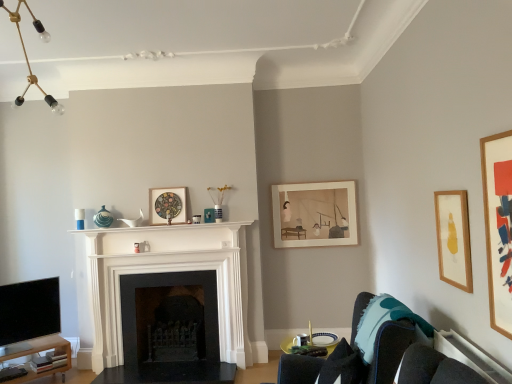
Identify the location of blank space above white marble fireplace at center, marked as the first fireplace in a front-to-back arrangement (from a real-world perspective). The height and width of the screenshot is (384, 512). (161, 232).